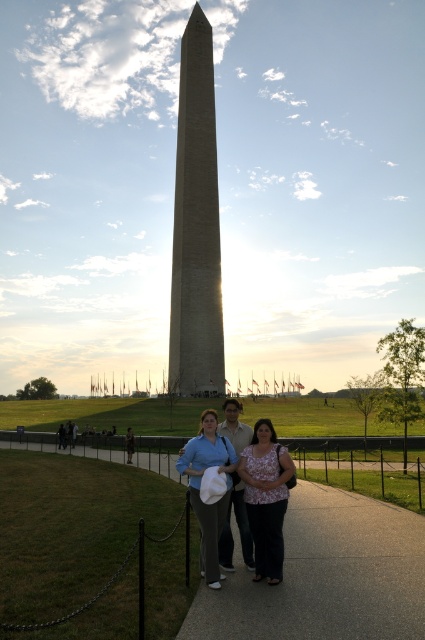
You are a photographer standing at the Washington Monument and want to take a photo of the concrete sidewalk at center and the matte blue shirt at center. How far apart are these two objects in meters?

The concrete sidewalk at center and matte blue shirt at center are 4.20 meters apart from each other.

You are a photographer trying to capture a group photo of the people at the Washington Monument. You notice the floral blouse at center and the matte blue shirt at center. Which clothing item is closer to the camera?

The floral blouse at center is positioned under the matte blue shirt at center, so the matte blue shirt at center is closer to the camera since it is above the floral blouse at center.

Consider the image. You are standing on the pathway near the Washington Monument and want to take a photo of the monument. You see two points marked on the ground at coordinates point (275, 474) and point (223, 522). Which point should you stand at to ensure you are closer to the monument?

You should stand at point (223, 522) because it is in front of point (275, 474), which is further away from the monument.